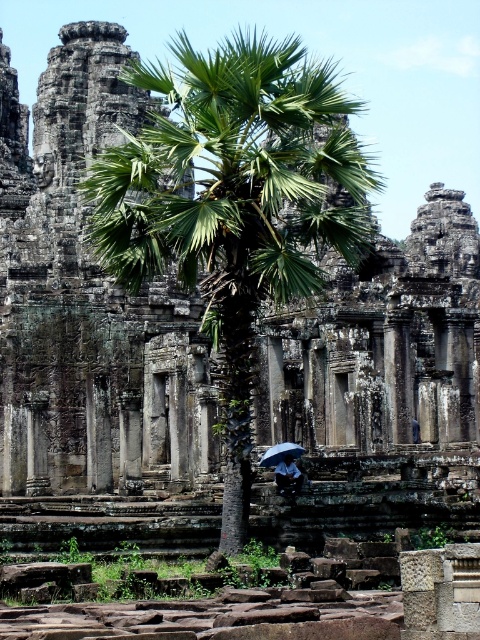
Based on the photo, you are standing at the entrance of the ancient stone structure and want to reach the dark blue fabric umbrella at center. What are the coordinates of the umbrella?

The coordinates of the dark blue fabric umbrella at center are at point (288, 476).

You are standing in front of the ancient stone structure and see both the dark blue fabric umbrella at center and the transparent plastic umbrella at center. Which umbrella is positioned to the right?

The dark blue fabric umbrella at center is positioned to the right of the transparent plastic umbrella at center.